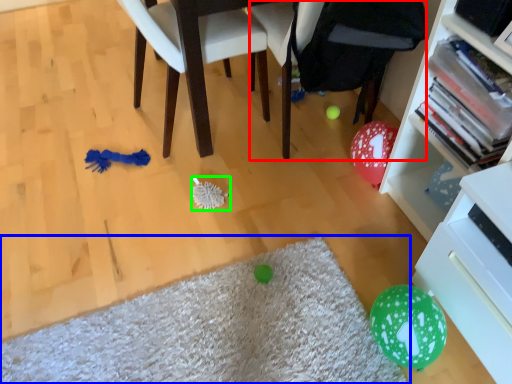
Question: Which object is positioned farthest from bean bag chair (highlighted by a red box)? Select from mat (highlighted by a blue box) and brush (highlighted by a green box).

Choices:
 (A) mat
 (B) brush

Answer: (A)